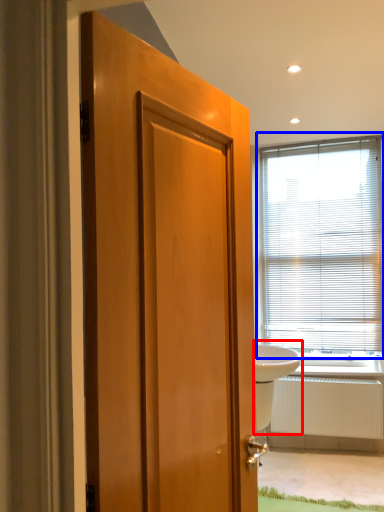
Question: Which object is closer to the camera taking this photo, sink (highlighted by a red box) or window blind (highlighted by a blue box)?

Choices:
 (A) sink
 (B) window blind

Answer: (A)